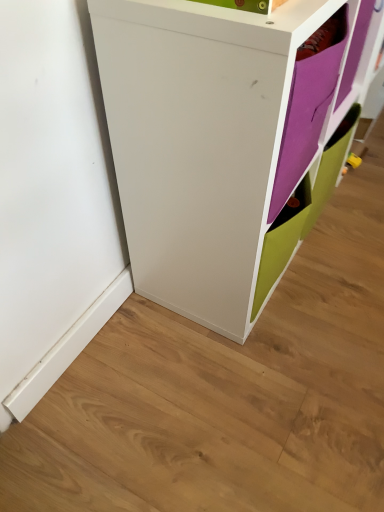
Question: From a real-world perspective, relative to purple matte paper at upper right, is white matte cabinet at center vertically above or below?

Choices:
 (A) below
 (B) above

Answer: (A)

Question: Is white matte cabinet at center inside the boundaries of purple matte paper at upper right, or outside?

Choices:
 (A) inside
 (B) outside

Answer: (B)

Question: Would you say white matte cabinet at center is to the left or to the right of purple matte paper at upper right in the picture?

Choices:
 (A) left
 (B) right

Answer: (A)

Question: Is purple matte paper at upper right bigger or smaller than white matte cabinet at center?

Choices:
 (A) small
 (B) big

Answer: (A)

Question: In terms of width, does purple matte paper at upper right look wider or thinner when compared to white matte cabinet at center?

Choices:
 (A) thin
 (B) wide

Answer: (A)

Question: Do you think purple matte paper at upper right is within white matte cabinet at center, or outside of it?

Choices:
 (A) inside
 (B) outside

Answer: (A)

Question: From their relative heights in the image, would you say purple matte paper at upper right is taller or shorter than white matte cabinet at center?

Choices:
 (A) tall
 (B) short

Answer: (B)